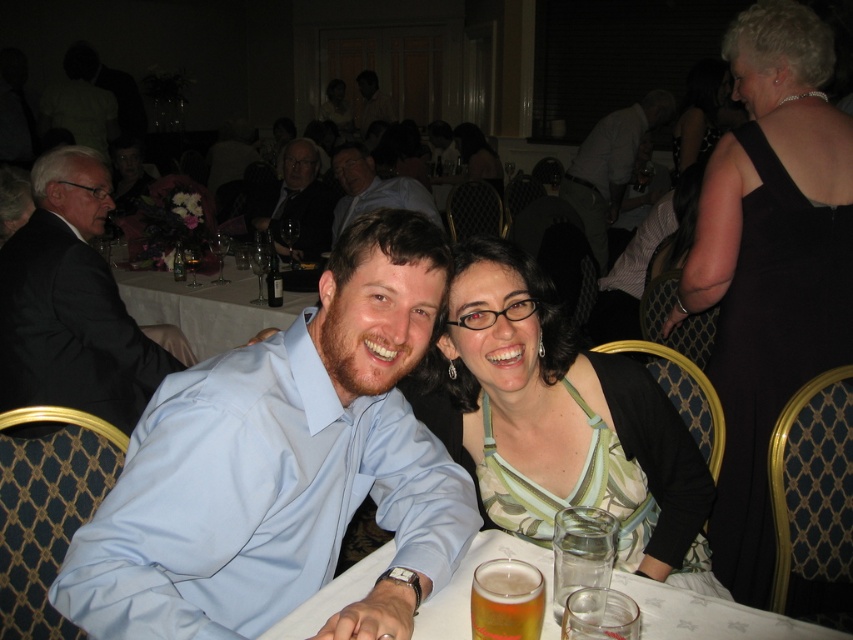
Question: Can you confirm if light blue satin shirt at center is bigger than clear glass beer at center?

Choices:
 (A) yes
 (B) no

Answer: (A)

Question: Which object is positioned farthest from the matte black shirt at upper center?

Choices:
 (A) matte white shirt at center
 (B) matte black suit at upper center

Answer: (A)

Question: Which point is farther from the camera taking this photo?

Choices:
 (A) (314, 177)
 (B) (134, 605)
 (C) (561, 371)

Answer: (A)

Question: Can you confirm if white cloth at center is bigger than light brown leather jacket at upper center?

Choices:
 (A) no
 (B) yes

Answer: (A)

Question: Which of the following is the closest to the observer?

Choices:
 (A) matte green dress at center
 (B) black suit at left
 (C) matte black shirt at upper center
 (D) white cloth at center

Answer: (A)

Question: Does amber glass beer at table center appear on the left side of matte white shirt at center?

Choices:
 (A) yes
 (B) no

Answer: (B)